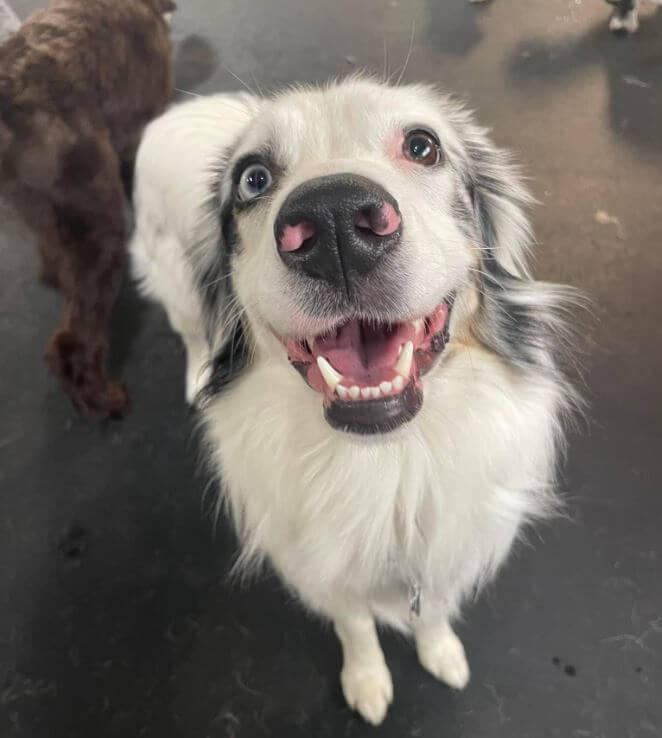
This screenshot has height=738, width=662. I want to click on floor, so (x=582, y=159).